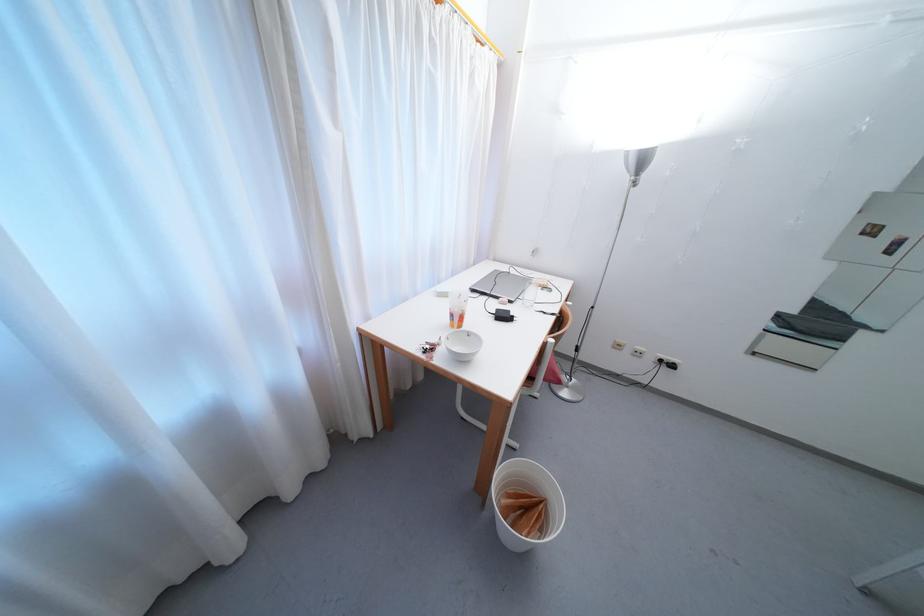
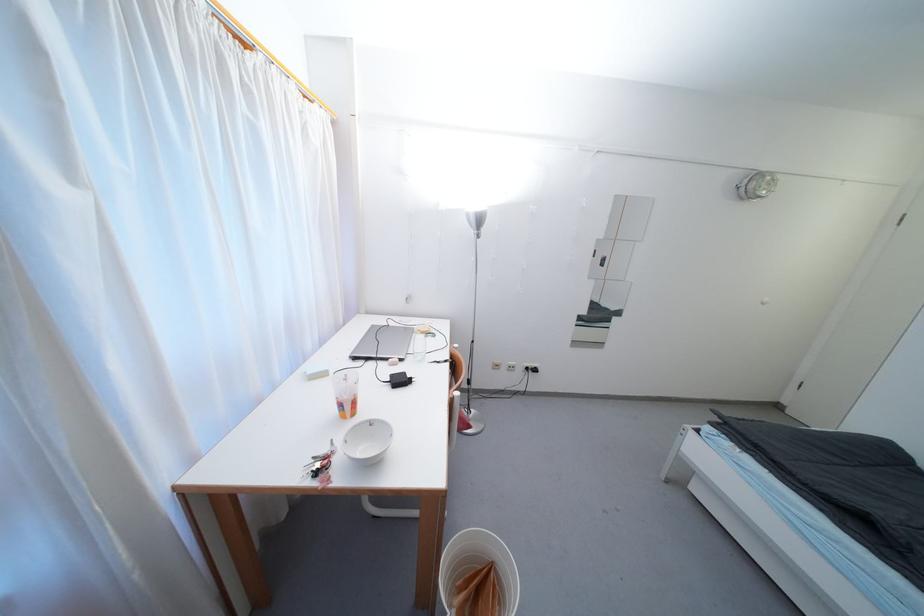
The point at (476, 334) is marked in the first image. Where is the corresponding point in the second image?

(379, 423)